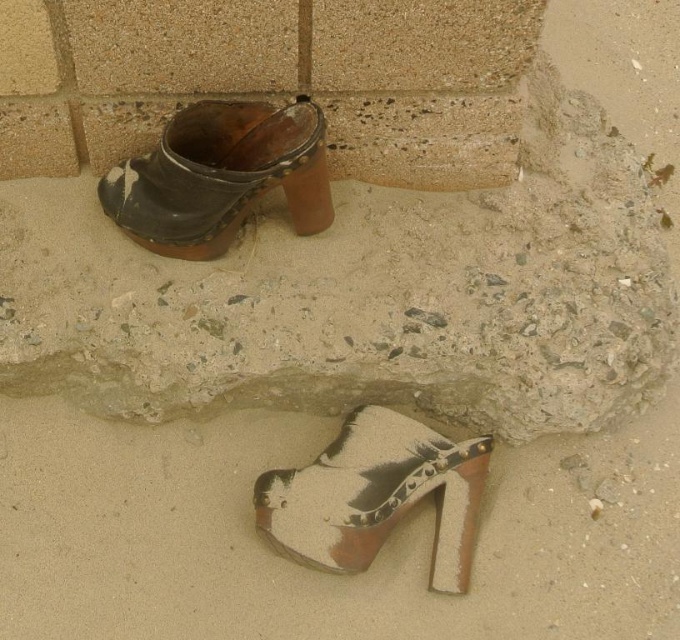
Does shiny metallic sandal at lower center have a lesser width compared to leather/cracked shoe at upper left?

Correct, shiny metallic sandal at lower center's width is less than leather/cracked shoe at upper left's.

Who is positioned more to the right, shiny metallic sandal at lower center or leather/cracked shoe at upper left?

shiny metallic sandal at lower center is more to the right.

Does point (352, 531) lie behind point (279, 177)?

No.

Identify the location of shiny metallic sandal at lower center. (375, 497).